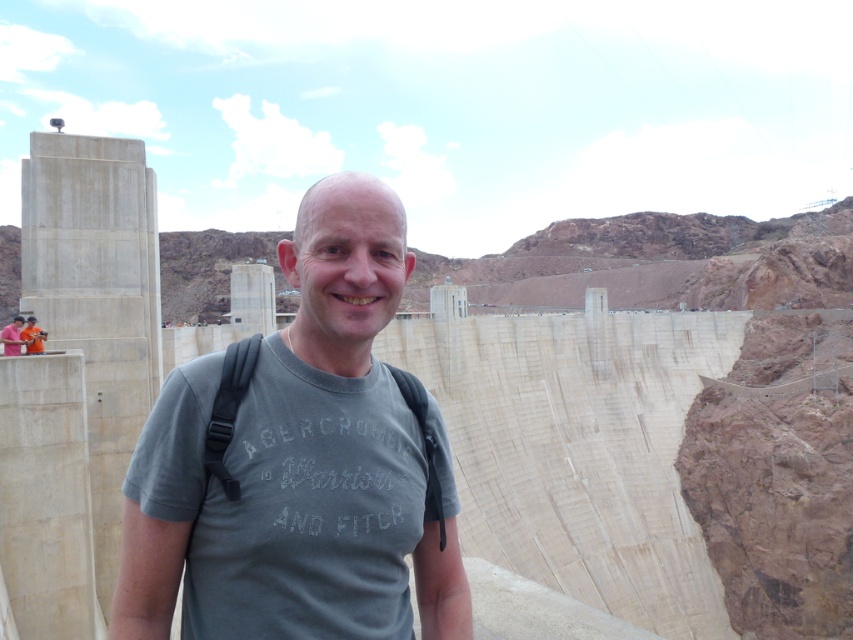
Question: Is gray cotton t-shirt at center closer to camera compared to pink fabric at upper left?

Choices:
 (A) yes
 (B) no

Answer: (A)

Question: Which point appears closest to the camera in this image?

Choices:
 (A) tap(3, 336)
 (B) tap(335, 248)

Answer: (B)

Question: Does gray cotton t-shirt at center lie in front of pink fabric at upper left?

Choices:
 (A) yes
 (B) no

Answer: (A)

Question: Can you confirm if gray cotton t-shirt at center is wider than pink fabric at upper left?

Choices:
 (A) yes
 (B) no

Answer: (A)